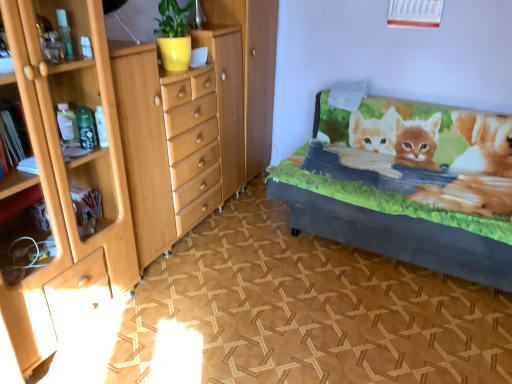
Question: Is velvet gray bed frame at right not near light wood chest of drawers at left?

Choices:
 (A) yes
 (B) no

Answer: (B)

Question: Could you tell me if velvet gray bed frame at right is turned towards light wood chest of drawers at left?

Choices:
 (A) yes
 (B) no

Answer: (B)

Question: From the image's perspective, would you say velvet gray bed frame at right is shown under light wood chest of drawers at left?

Choices:
 (A) no
 (B) yes

Answer: (B)

Question: Considering the relative sizes of velvet gray bed frame at right and light wood chest of drawers at left in the image provided, is velvet gray bed frame at right thinner than light wood chest of drawers at left?

Choices:
 (A) yes
 (B) no

Answer: (B)

Question: Is light wood chest of drawers at left at the back of velvet gray bed frame at right?

Choices:
 (A) yes
 (B) no

Answer: (B)

Question: Does velvet gray bed frame at right have a larger size compared to light wood chest of drawers at left?

Choices:
 (A) yes
 (B) no

Answer: (A)

Question: Is light wood chest of drawers at left facing away from velvet gray bed frame at right?

Choices:
 (A) yes
 (B) no

Answer: (B)

Question: Can you confirm if light wood chest of drawers at left is bigger than velvet gray bed frame at right?

Choices:
 (A) no
 (B) yes

Answer: (A)

Question: Is light wood chest of drawers at left thinner than velvet gray bed frame at right?

Choices:
 (A) yes
 (B) no

Answer: (A)

Question: Does light wood chest of drawers at left appear on the left side of velvet gray bed frame at right?

Choices:
 (A) yes
 (B) no

Answer: (A)

Question: Does light wood chest of drawers at left lie in front of velvet gray bed frame at right?

Choices:
 (A) no
 (B) yes

Answer: (B)

Question: Can you confirm if light wood chest of drawers at left is wider than velvet gray bed frame at right?

Choices:
 (A) no
 (B) yes

Answer: (A)

Question: Is velvet gray bed frame at right in front of or behind light wood chest of drawers at left in the image?

Choices:
 (A) behind
 (B) front

Answer: (A)